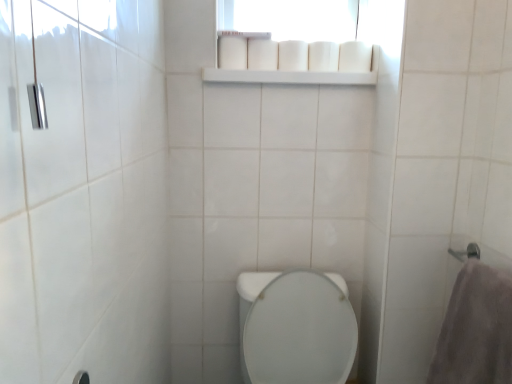
Question: From the image's perspective, is gray plush towel at right positioned above or below white matte toilet paper at upper center, acting as the 2th toilet paper starting from the right?

Choices:
 (A) below
 (B) above

Answer: (A)

Question: From a real-world perspective, is gray plush towel at right above or below white matte toilet paper at upper center, acting as the 2th toilet paper starting from the right?

Choices:
 (A) above
 (B) below

Answer: (B)

Question: Estimate the real-world distances between objects in this image. Which object is farther from the white matte toilet paper at upper center, which is counted as the fourth toilet paper, starting from the left?

Choices:
 (A) white matte shelf at upper center
 (B) white matte toilet paper at upper center, marked as the fourth toilet paper in a right-to-left arrangement
 (C) gray plush towel at right
 (D) white matte toilet paper at upper center, which appears as the 3th toilet paper when viewed from the left
 (E) white matte toilet paper at upper center, the first toilet paper viewed from the right

Answer: (C)

Question: Which of these objects is positioned farthest from the white glossy toilet at center?

Choices:
 (A) white matte shelf at upper center
 (B) white matte toilet paper at upper center, which appears as the 3th toilet paper when viewed from the left
 (C) white matte toilet paper at upper center, marked as the 5th toilet paper in a left-to-right arrangement
 (D) white matte toilet paper at upper center, acting as the 2th toilet paper starting from the right
 (E) gray plush towel at right

Answer: (D)